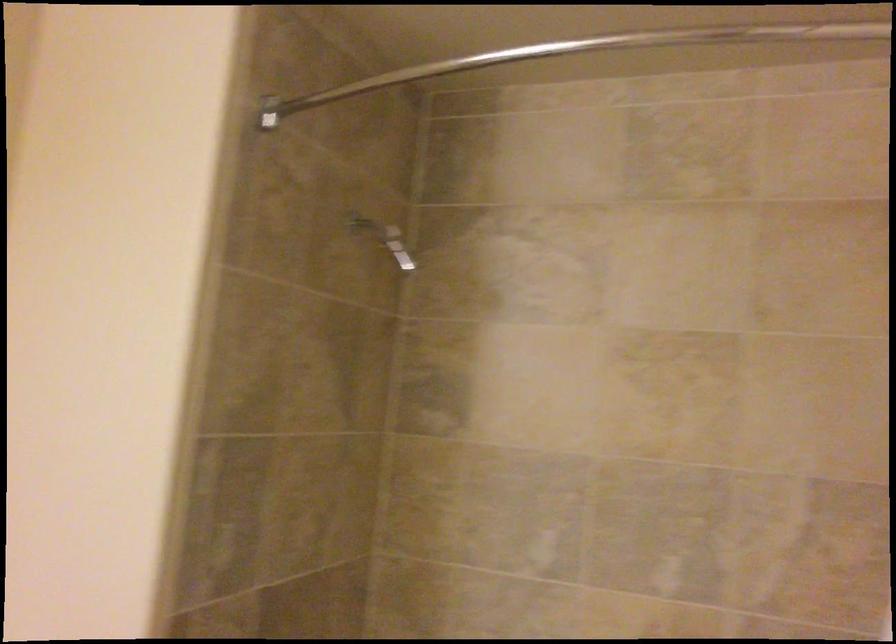
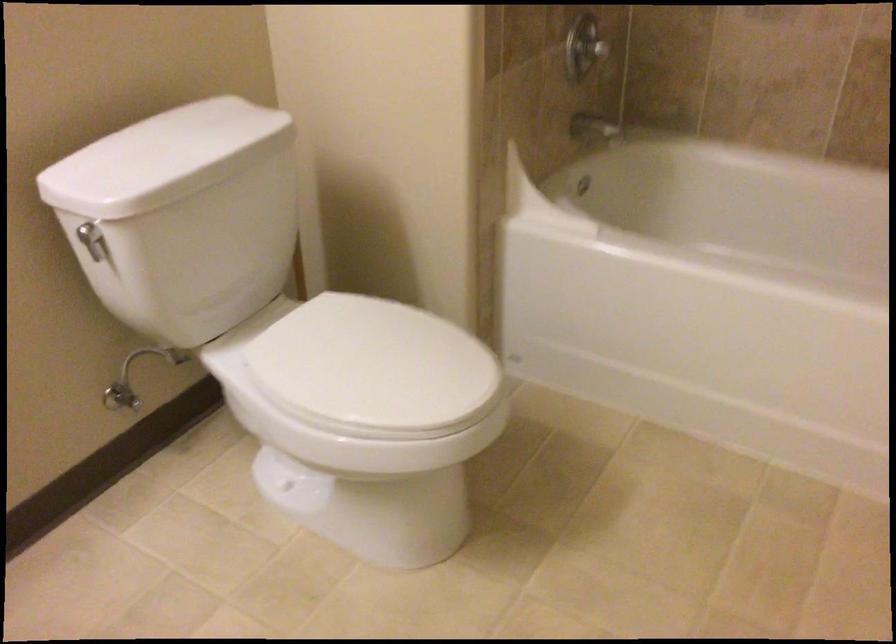
Question: How did the camera likely rotate?

Choices:
 (A) Left
 (B) Right
 (C) Up
 (D) Down

Answer: (D)